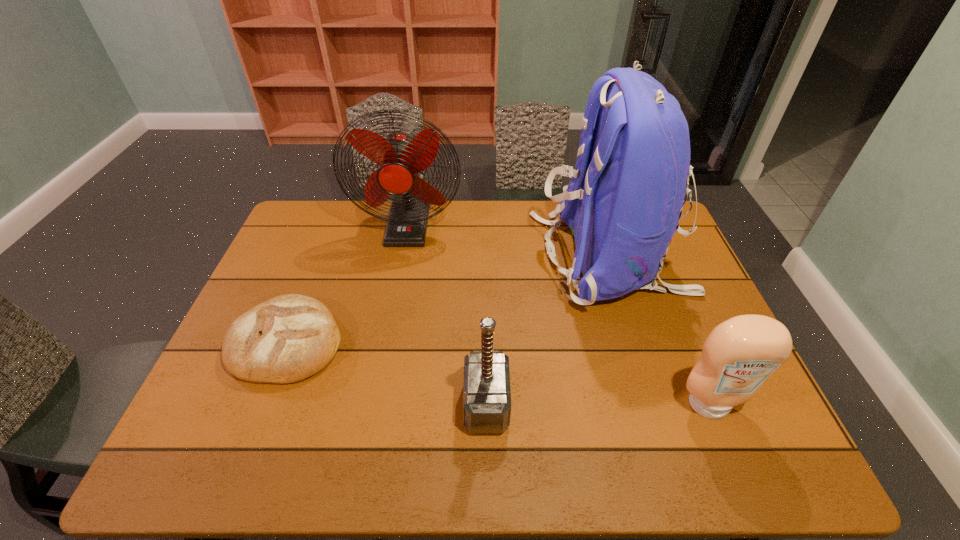
The image size is (960, 540). Find the location of `vacant position located on the label of the condiment`. vacant position located on the label of the condiment is located at coordinates (732, 462).

I want to click on free space located on the front of the bread, so (237, 468).

This screenshot has height=540, width=960. What are the coordinates of `backpack that is at the far edge` in the screenshot? It's located at (625, 198).

What are the coordinates of `fan positioned at the far edge` in the screenshot? It's located at (401, 156).

At what (x,y) coordinates should I click in order to perform the action: click on object present at the near edge. Please return your answer as a coordinate pair (x, y). Looking at the image, I should click on (486, 390).

Identify the location of object that is at the left edge. This screenshot has height=540, width=960. (286, 339).

At what (x,y) coordinates should I click in order to perform the action: click on backpack that is at the right edge. Please return your answer as a coordinate pair (x, y). This screenshot has width=960, height=540. Looking at the image, I should click on (625, 198).

The width and height of the screenshot is (960, 540). In order to click on condiment located in the right edge section of the desktop in this screenshot , I will do `click(738, 356)`.

Find the location of a particular element. The height and width of the screenshot is (540, 960). object that is at the far right corner is located at coordinates (625, 198).

The image size is (960, 540). Identify the location of free space at the far edge of the desktop. (481, 228).